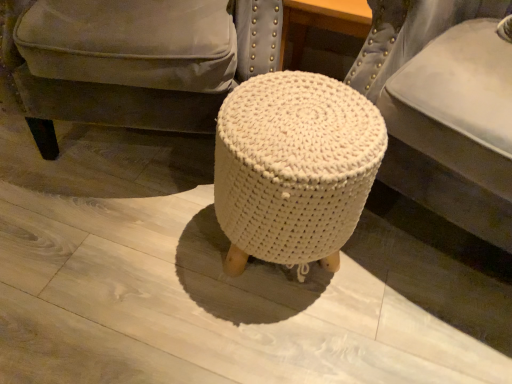
Question: Is white knitted stool at center positioned beyond the bounds of white knitted pouf at center?

Choices:
 (A) no
 (B) yes

Answer: (B)

Question: Is white knitted stool at center looking in the opposite direction of white knitted pouf at center?

Choices:
 (A) no
 (B) yes

Answer: (B)

Question: Is the position of white knitted stool at center more distant than that of white knitted pouf at center?

Choices:
 (A) no
 (B) yes

Answer: (B)

Question: Does white knitted stool at center have a larger size compared to white knitted pouf at center?

Choices:
 (A) no
 (B) yes

Answer: (A)

Question: Does white knitted stool at center have a smaller size compared to white knitted pouf at center?

Choices:
 (A) no
 (B) yes

Answer: (B)

Question: Does white knitted stool at center turn towards white knitted pouf at center?

Choices:
 (A) yes
 (B) no

Answer: (B)

Question: From the image's perspective, is white knitted pouf at center under white knitted stool at center?

Choices:
 (A) yes
 (B) no

Answer: (A)

Question: Is white knitted pouf at center at the left side of white knitted stool at center?

Choices:
 (A) no
 (B) yes

Answer: (A)

Question: Considering the relative sizes of white knitted pouf at center and white knitted stool at center in the image provided, is white knitted pouf at center taller than white knitted stool at center?

Choices:
 (A) no
 (B) yes

Answer: (B)

Question: From a real-world perspective, does white knitted pouf at center stand above white knitted stool at center?

Choices:
 (A) yes
 (B) no

Answer: (A)

Question: Is white knitted stool at center completely or partially inside white knitted pouf at center?

Choices:
 (A) no
 (B) yes

Answer: (A)

Question: Can you confirm if white knitted pouf at center is smaller than white knitted stool at center?

Choices:
 (A) yes
 (B) no

Answer: (A)

Question: Is white knitted stool at center bigger than white knitted stool at center?

Choices:
 (A) no
 (B) yes

Answer: (A)